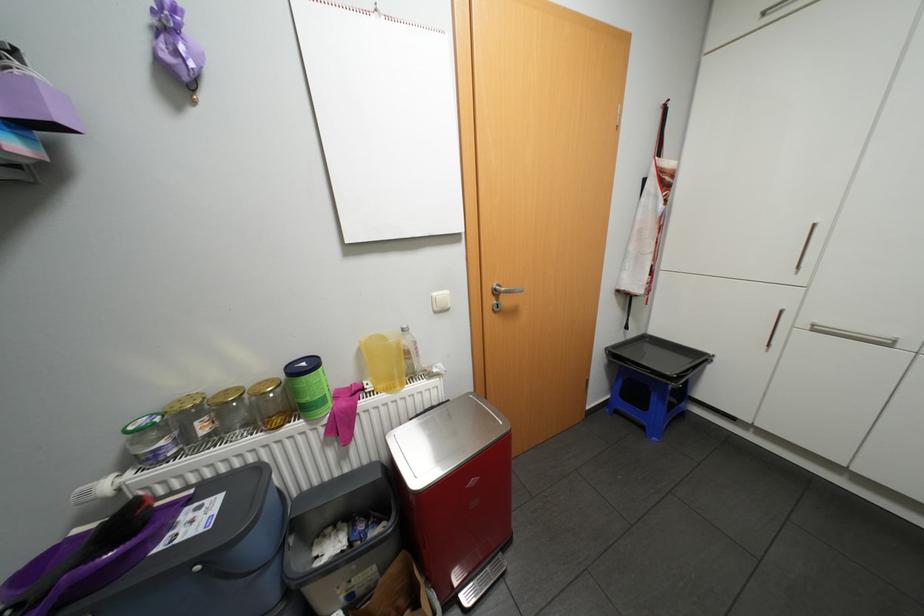
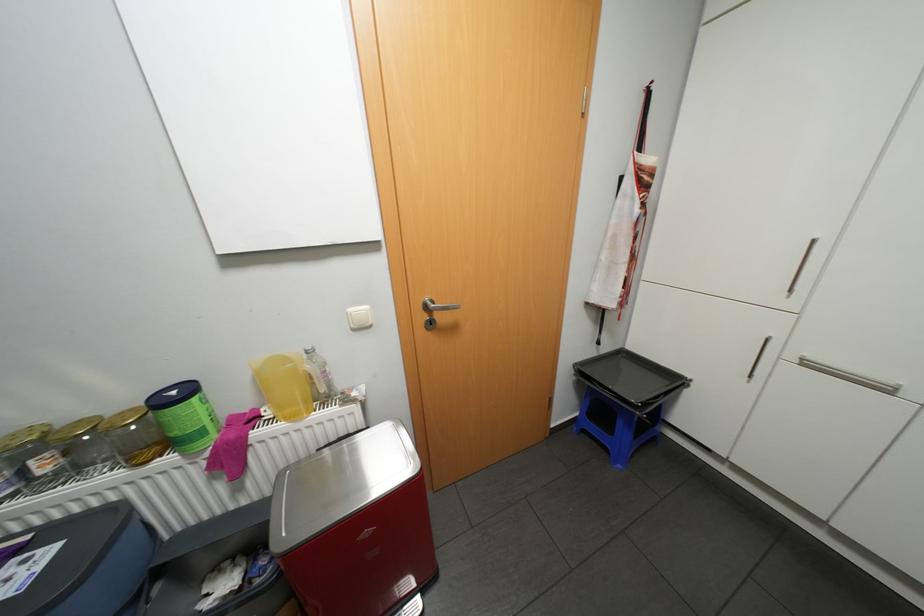
Where in the second image is the point corresponding to [314,419] from the first image?

(190, 453)